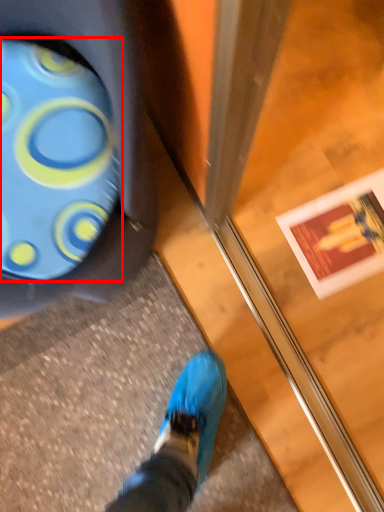
Question: From the image's perspective, where is footwear (annotated by the red box) located in relation to screen door in the image?

Choices:
 (A) below
 (B) above

Answer: (B)